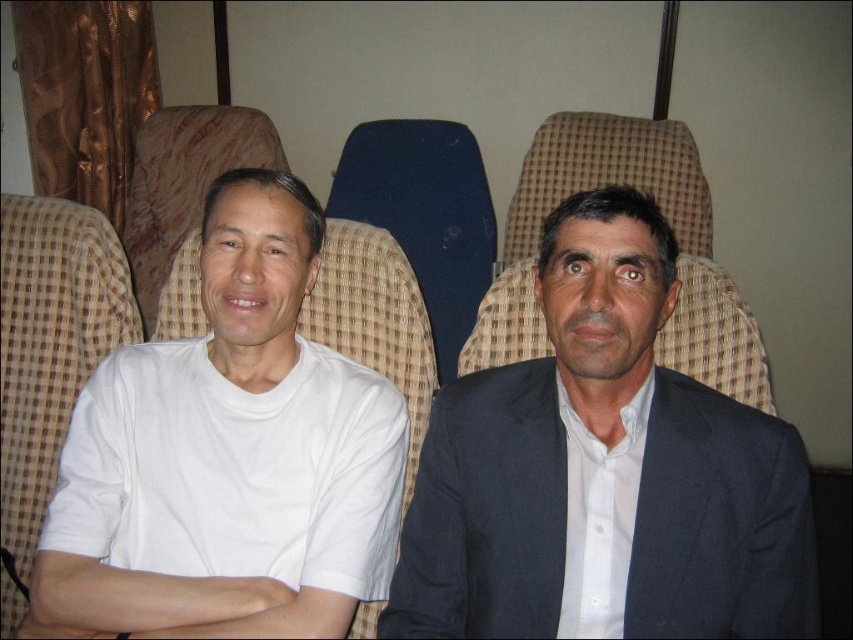
In the scene shown: Does woven fabric chair at center have a smaller size compared to blue fabric chair at center?

No.

Does woven fabric chair at center have a greater height compared to blue fabric chair at center?

No, woven fabric chair at center is not taller than blue fabric chair at center.

Find the location of `woven fabric chair at center`. woven fabric chair at center is located at coordinates (674, 230).

Where is `woven fabric chair at center`? This screenshot has width=853, height=640. woven fabric chair at center is located at coordinates (674, 230).

Is white fabric chair at left thinner than blue fabric chair at center?

→ Indeed, white fabric chair at left has a lesser width compared to blue fabric chair at center.

In the scene shown: Between white fabric chair at left and blue fabric chair at center, which one is positioned lower?

Positioned lower is white fabric chair at left.

Based on the photo, who is more distant from viewer, (x=20, y=602) or (x=399, y=243)?

The point (x=399, y=243) is more distant.

Locate an element on the screen. white fabric chair at left is located at coordinates (51, 342).

Between woven fabric chair at center and beige fabric chair at left, which one is positioned lower?

beige fabric chair at left is lower down.

Find the location of a particular element. woven fabric chair at center is located at coordinates (674, 230).

The width and height of the screenshot is (853, 640). Find the location of `woven fabric chair at center`. woven fabric chair at center is located at coordinates click(x=674, y=230).